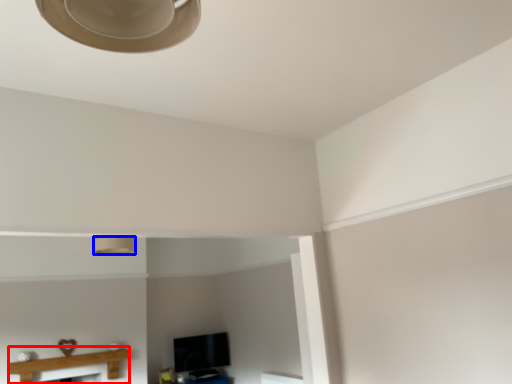
Question: Among these objects, which one is farthest to the camera, table (highlighted by a red box) or lamp (highlighted by a blue box)?

Choices:
 (A) table
 (B) lamp

Answer: (A)